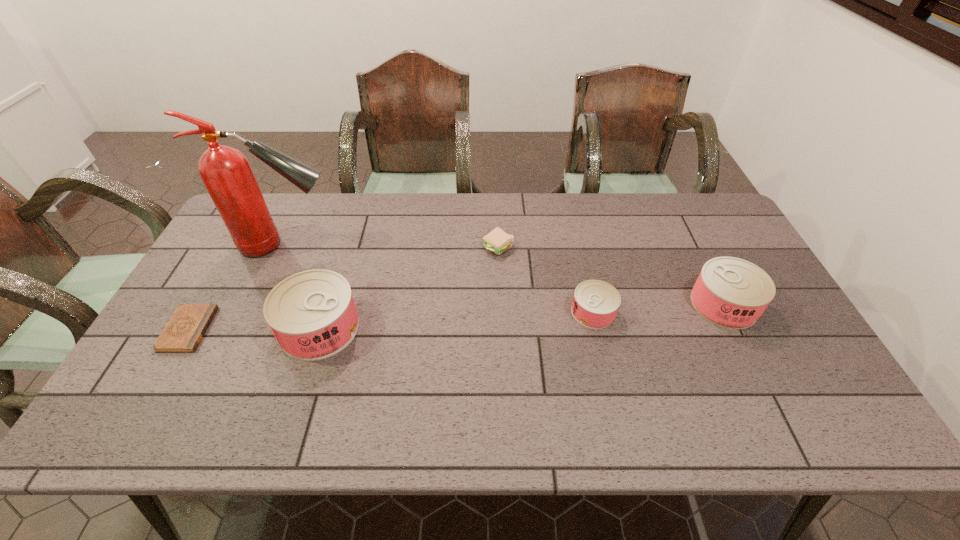
In order to click on vacant area situated on the left of the shortest can in this screenshot , I will do `click(446, 312)`.

Identify the location of vacant space located 0.210m on the left of the second tallest can. (615, 305).

Locate an element on the screen. free location located on the left of the second shortest object is located at coordinates (435, 248).

Where is `vacant space situated 0.270m at the nozzle end of the tallest object`? This screenshot has width=960, height=540. vacant space situated 0.270m at the nozzle end of the tallest object is located at coordinates (426, 245).

Image resolution: width=960 pixels, height=540 pixels. In order to click on vacant space located on the spine side of the shortest object in this screenshot , I will do `click(314, 329)`.

Find the location of a particular element. This screenshot has width=960, height=540. patty situated at the far edge is located at coordinates (497, 241).

You are a GUI agent. You are given a task and a screenshot of the screen. Output one action in this format:
    pyautogui.click(x=<x>, y=<y>)
    Task: Click on the fire extinguisher located in the far edge section of the desktop
    The width and height of the screenshot is (960, 540).
    Given the screenshot: What is the action you would take?
    pyautogui.click(x=226, y=173)

I want to click on fire extinguisher situated at the left edge, so click(x=226, y=173).

What are the coordinates of `diary situated at the left edge` in the screenshot? It's located at (184, 331).

You are a GUI agent. You are given a task and a screenshot of the screen. Output one action in this format:
    pyautogui.click(x=<x>, y=<y>)
    Task: Click on the object located at the right edge
    This screenshot has height=540, width=960.
    Given the screenshot: What is the action you would take?
    click(x=730, y=292)